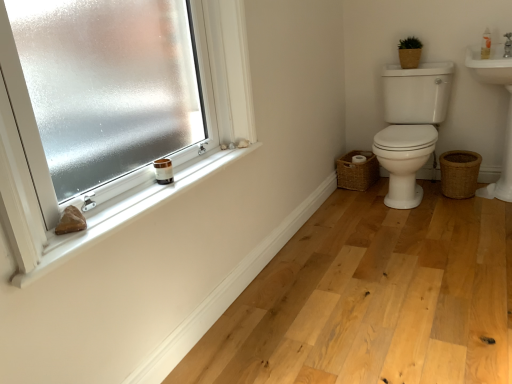
At what (x,y) coordinates should I click in order to perform the action: click on white ceramic sink at upper right. Please return your answer as a coordinate pair (x, y). Looking at the image, I should click on (508, 110).

How much space does woven brown basket at lower right, acting as the 3th basket starting from the top, occupy horizontally?

It is 11.18 inches.

The width and height of the screenshot is (512, 384). What do you see at coordinates (112, 110) in the screenshot?
I see `frosted glass window at upper left` at bounding box center [112, 110].

Image resolution: width=512 pixels, height=384 pixels. What are the coordinates of `brown woven basket at upper right, placed as the 1th basket when sorted from top to bottom` in the screenshot? It's located at [x=409, y=58].

Considering the points (485, 40) and (389, 145), which point is behind, point (485, 40) or point (389, 145)?

The point (485, 40) is farther from the camera.

Considering the sizes of white plastic bottle at upper right and white glossy toilet at right in the image, is white plastic bottle at upper right wider or thinner than white glossy toilet at right?

Clearly, white plastic bottle at upper right has less width compared to white glossy toilet at right.

How many degrees apart are the facing directions of white plastic bottle at upper right and white glossy toilet at right?

4.09 degrees separate the facing orientations of white plastic bottle at upper right and white glossy toilet at right.

In the scene shown: Is white plastic bottle at upper right beside white glossy toilet at right?

No, white plastic bottle at upper right is not touching white glossy toilet at right.

Based on the photo, can you confirm if white ceramic sink at upper right is bigger than woven brown basket at lower right, marked as the first basket in a bottom-to-top arrangement?

Yes.

From a real-world perspective, relative to woven brown basket at lower right, placed as the 1th basket when sorted from right to left, is white ceramic sink at upper right vertically above or below?

Clearly, from a real-world perspective, white ceramic sink at upper right is above woven brown basket at lower right, placed as the 1th basket when sorted from right to left.

Would you say white ceramic sink at upper right contains woven brown basket at lower right, which is counted as the third basket, starting from the left?

Yes, white ceramic sink at upper right is surrounding woven brown basket at lower right, which is counted as the third basket, starting from the left.

Considering the sizes of white ceramic sink at upper right and woven brown basket at lower right, marked as the first basket in a bottom-to-top arrangement, in the image, is white ceramic sink at upper right taller or shorter than woven brown basket at lower right, marked as the first basket in a bottom-to-top arrangement,?

white ceramic sink at upper right is taller than woven brown basket at lower right, marked as the first basket in a bottom-to-top arrangement.

From a real-world perspective, is woven brown basket at lower right, marked as the first basket in a bottom-to-top arrangement, above or below white plastic bottle at upper right?

Clearly, from a real-world perspective, woven brown basket at lower right, marked as the first basket in a bottom-to-top arrangement, is below white plastic bottle at upper right.

Considering their positions, is woven brown basket at lower right, which is counted as the third basket, starting from the left, located in front of or behind white plastic bottle at upper right?

woven brown basket at lower right, which is counted as the third basket, starting from the left, is positioned farther from the viewer than white plastic bottle at upper right.

Consider the image. Which of these two, woven brown basket at lower right, which is counted as the third basket, starting from the left, or white plastic bottle at upper right, stands shorter?

white plastic bottle at upper right.

From the image's perspective, between woven brown basket at lower right, placed as the 1th basket when sorted from right to left, and white plastic bottle at upper right, which one is located above?

white plastic bottle at upper right is shown above in the image.

Consider the image. Between white glossy toilet at right and white ceramic sink at upper right, which one has larger width?

Wider between the two is white glossy toilet at right.

Is white ceramic sink at upper right located within white glossy toilet at right?

No, white ceramic sink at upper right is not a part of white glossy toilet at right.

Considering the positions of objects white glossy toilet at right and white ceramic sink at upper right in the image provided, who is more to the left, white glossy toilet at right or white ceramic sink at upper right?

From the viewer's perspective, white glossy toilet at right appears more on the left side.

Is white matte window sill at upper left at the right side of frosted glass window at upper left?

Correct, you'll find white matte window sill at upper left to the right of frosted glass window at upper left.

Consider the image. From the image's perspective, relative to frosted glass window at upper left, is white matte window sill at upper left above or below?

Clearly, from the image's perspective, white matte window sill at upper left is below frosted glass window at upper left.

Where is `window sill below the frosted glass window at upper left (from a real-world perspective)`? window sill below the frosted glass window at upper left (from a real-world perspective) is located at coordinates (140, 201).

How different are the orientations of white matte window sill at upper left and frosted glass window at upper left in degrees?

0.524 degrees.

Is frosted glass window at upper left turned away from woven brown basket at lower right, placed as the 1th basket when sorted from right to left?

No, frosted glass window at upper left is not facing away from woven brown basket at lower right, placed as the 1th basket when sorted from right to left.

Is frosted glass window at upper left not near woven brown basket at lower right, which is counted as the third basket, starting from the left?

Yes.

Which is nearer, (45, 4) or (464, 180)?

Point (45, 4).

Is frosted glass window at upper left further to camera compared to woven brown basket at lower right, placed as the 1th basket when sorted from right to left?

No, it is in front of woven brown basket at lower right, placed as the 1th basket when sorted from right to left.

How many degrees apart are the facing directions of white plastic bottle at upper right and woven brown basket at lower right, acting as the 3th basket starting from the top?

white plastic bottle at upper right and woven brown basket at lower right, acting as the 3th basket starting from the top, are facing 0.589 degrees away from each other.

Considering the positions of point (487, 50) and point (462, 178), is point (487, 50) closer or farther from the camera than point (462, 178)?

Clearly, point (487, 50) is closer to the camera than point (462, 178).

Which object is further away from the camera, white plastic bottle at upper right or woven brown basket at lower right, which is counted as the third basket, starting from the left?

woven brown basket at lower right, which is counted as the third basket, starting from the left.

Is white plastic bottle at upper right to the left or to the right of woven brown basket at lower right, acting as the 3th basket starting from the top, in the image?

white plastic bottle at upper right is positioned on woven brown basket at lower right, acting as the 3th basket starting from the top,'s right side.

Locate an element on the screen. The image size is (512, 384). open beneath the white plastic bottle at upper right (from a real-world perspective) is located at coordinates (410, 126).

Starting from the white ceramic sink at upper right, which basket is the 1st one to the left? Please provide its 2D coordinates.

[(459, 173)]

Based on the photo, looking at the image, which one is located closer to white ceramic sink at upper right, white matte window sill at upper left or white plastic bottle at upper right?

white plastic bottle at upper right is positioned closer to the anchor white ceramic sink at upper right.

Looking at the image, which one is located further to natural wood floor at lower center, brown woven basket at upper right, the 2th basket when ordered from right to left, or white glossy toilet at right?

The object further to natural wood floor at lower center is brown woven basket at upper right, the 2th basket when ordered from right to left.

When comparing their distances from white plastic bottle at upper right, does frosted glass window at upper left or white glossy toilet at right seem closer?

Among the two, white glossy toilet at right is located nearer to white plastic bottle at upper right.

Based on their spatial positions, is brown woven basket at upper right, the 2th basket when ordered from right to left, or white plastic bottle at upper right further from white glossy toilet at right?

white plastic bottle at upper right is further to white glossy toilet at right.

In the scene shown: Based on their spatial positions, is natural wood floor at lower center or white plastic bottle at upper right further from frosted glass window at upper left?

white plastic bottle at upper right is further to frosted glass window at upper left.

Based on their spatial positions, is white plastic bottle at upper right or natural wood floor at lower center closer to white glossy toilet at right?

white plastic bottle at upper right is closer to white glossy toilet at right.

Considering their positions, is white matte window sill at upper left positioned further to white ceramic sink at upper right than woven brown basket at lower right, which appears as the first basket when viewed from the left?

white matte window sill at upper left.

Based on their spatial positions, is frosted glass window at upper left or woven brown basket at lower right, which is counted as the third basket, starting from the left, further from white matte window sill at upper left?

The object further to white matte window sill at upper left is frosted glass window at upper left.

At what (x,y) coordinates should I click in order to perform the action: click on sink between frosted glass window at upper left and woven brown basket at lower right, marked as the third basket in a right-to-left arrangement, from front to back. Please return your answer as a coordinate pair (x, y). The height and width of the screenshot is (384, 512). Looking at the image, I should click on (508, 110).

Identify the location of open that lies between white plastic bottle at upper right and woven brown basket at lower right, which ranks as the 2th basket in top-to-bottom order, from top to bottom. The height and width of the screenshot is (384, 512). (410, 126).

Where is `basket between white plastic bottle at upper right and white ceramic sink at upper right in the up-down direction`? This screenshot has height=384, width=512. basket between white plastic bottle at upper right and white ceramic sink at upper right in the up-down direction is located at coordinates (409, 58).

Where is `sink located between natural wood floor at lower center and white plastic bottle at upper right in the depth direction`? This screenshot has width=512, height=384. sink located between natural wood floor at lower center and white plastic bottle at upper right in the depth direction is located at coordinates (508, 110).